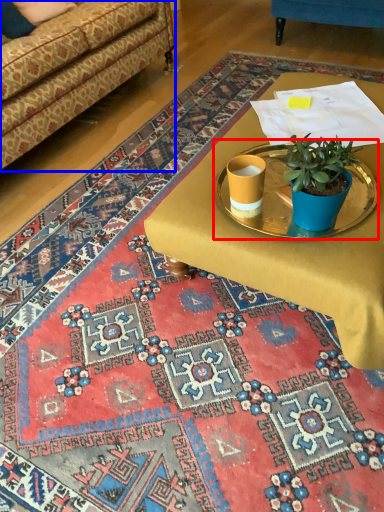
Question: Among these objects, which one is farthest to the camera, round table (highlighted by a red box) or studio couch (highlighted by a blue box)?

Choices:
 (A) round table
 (B) studio couch

Answer: (B)